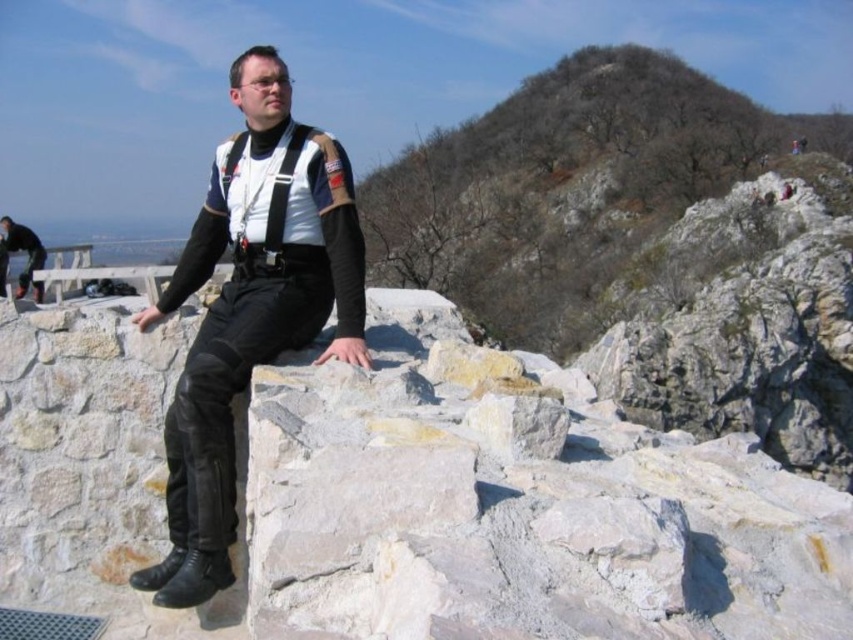
Who is taller, matte black leather pants at center or black leather pants at lower left?

With more height is matte black leather pants at center.

Does point (283, 104) lie in front of point (12, 244)?

Yes, it is.

Between point (225, 464) and point (32, 237), which one is positioned in front?

Positioned in front is point (225, 464).

Locate an element on the screen. The height and width of the screenshot is (640, 853). matte black leather pants at center is located at coordinates (251, 308).